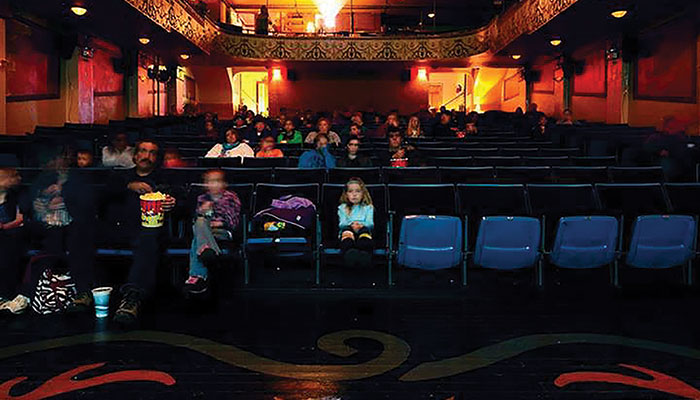
Locate an element on the screen. The width and height of the screenshot is (700, 400). lights is located at coordinates (78, 13), (141, 41), (183, 58), (276, 73), (424, 77), (516, 59), (553, 39), (619, 14), (430, 16).